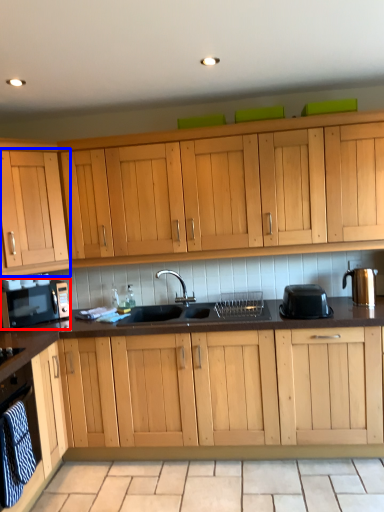
Question: Which object appears closest to the camera in this image, home appliance (highlighted by a red box) or cabinetry (highlighted by a blue box)?

Choices:
 (A) home appliance
 (B) cabinetry

Answer: (B)